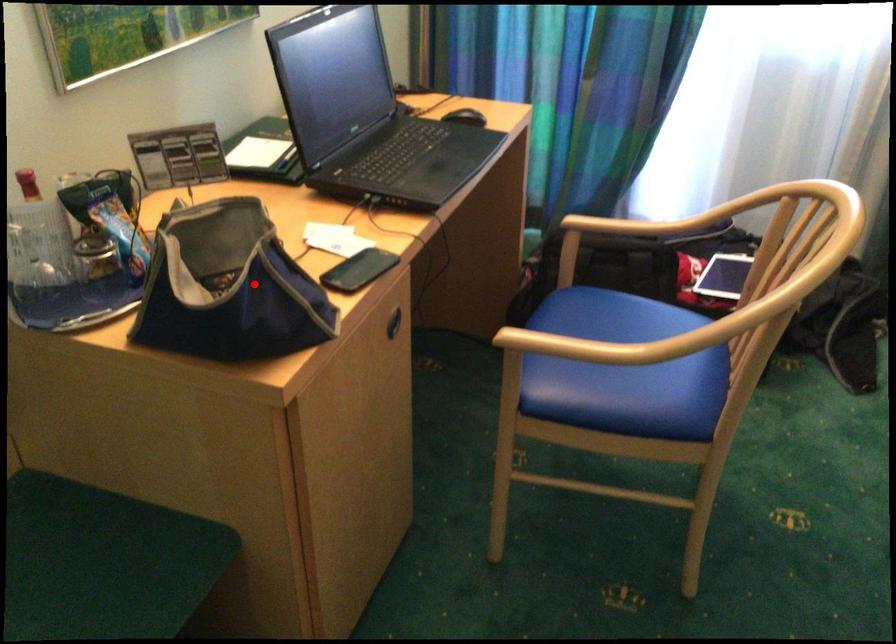
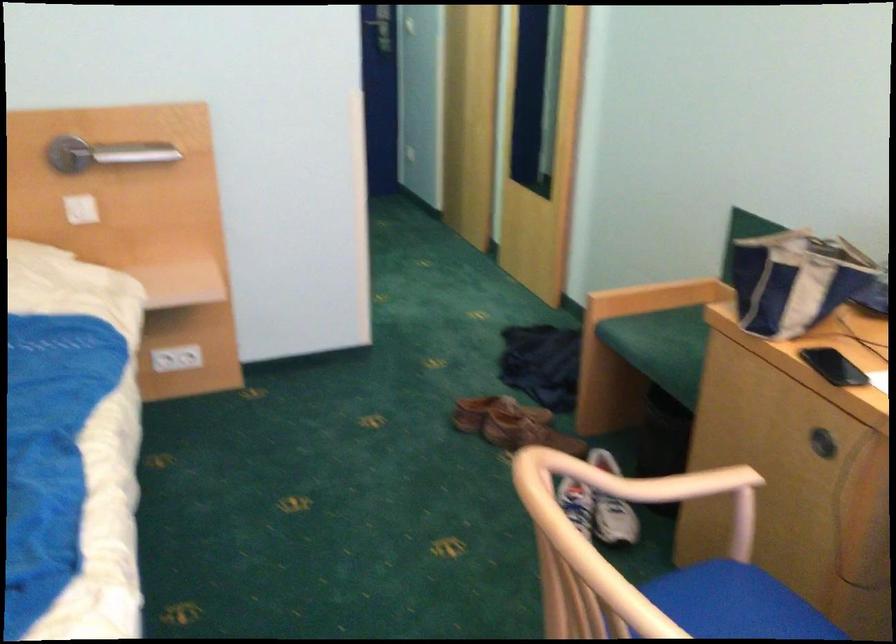
Question: A red point is marked in image1. In image2, is the corresponding 3D point closer to the camera or farther? Reply with the corresponding letter.

Choices:
 (A) The corresponding 3D point is closer.
 (B) The corresponding 3D point is farther.

Answer: (B)